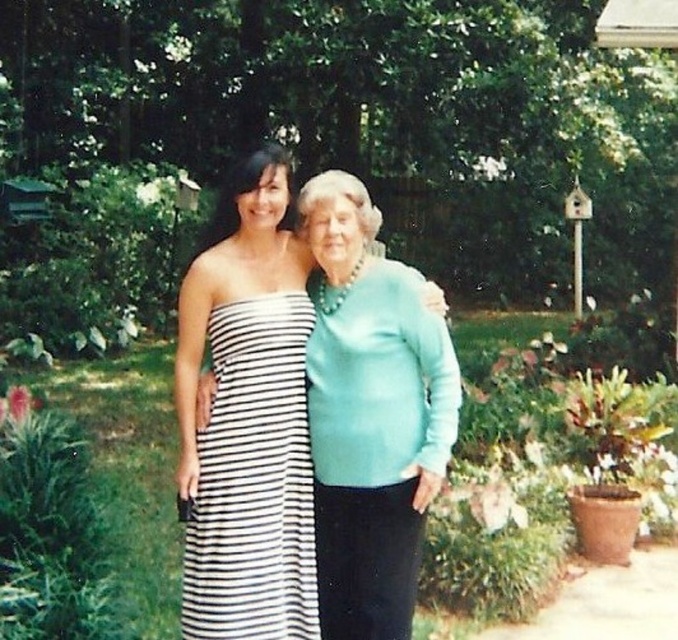
Is teal satin blouse at center thinner than black and white striped dress at center?

No, teal satin blouse at center is not thinner than black and white striped dress at center.

What do you see at coordinates (372, 413) in the screenshot? This screenshot has height=640, width=678. I see `teal satin blouse at center` at bounding box center [372, 413].

Where is `teal satin blouse at center`? The width and height of the screenshot is (678, 640). teal satin blouse at center is located at coordinates (372, 413).